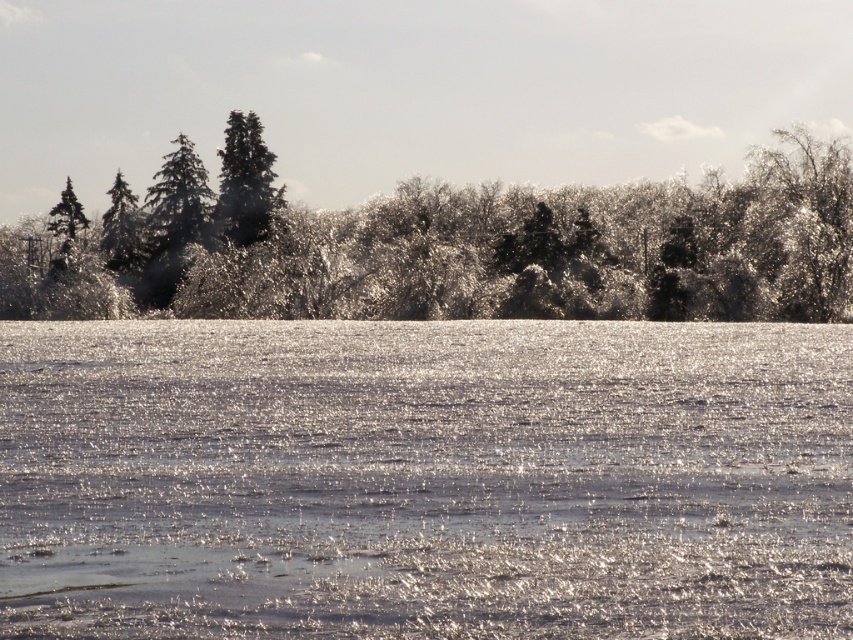
Question: Is sparkling ice at center in front of glossy evergreen trees at upper center?

Choices:
 (A) yes
 (B) no

Answer: (A)

Question: Which is farther from the green matte tree at upper left?

Choices:
 (A) glossy evergreen trees at upper center
 (B) green matte tree at upper center
 (C) sparkling ice at center

Answer: (C)

Question: Does sparkling ice at center appear on the right side of glossy evergreen trees at upper center?

Choices:
 (A) no
 (B) yes

Answer: (B)

Question: Which of the following is the farthest from the observer?

Choices:
 (A) (254, 205)
 (B) (497, 298)

Answer: (A)

Question: Which point is farther to the camera?

Choices:
 (A) green matte tree at upper left
 (B) green matte tree at upper center

Answer: (B)

Question: Considering the relative positions of glossy evergreen trees at upper center and green matte tree at upper left in the image provided, where is glossy evergreen trees at upper center located with respect to green matte tree at upper left?

Choices:
 (A) below
 (B) above

Answer: (B)